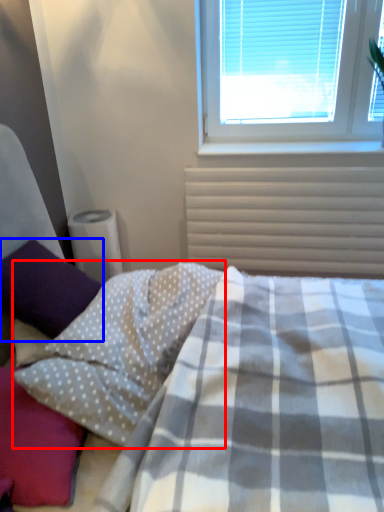
Question: Which point is further to the camera, pillow (highlighted by a red box) or pillow (highlighted by a blue box)?

Choices:
 (A) pillow
 (B) pillow

Answer: (B)